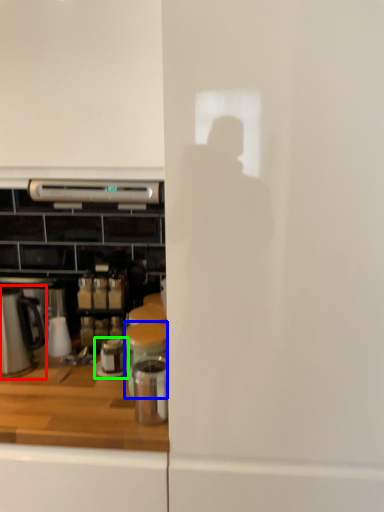
Question: Which is farther away from kitchen appliance (highlighted by a red box)? appliance (highlighted by a blue box) or appliance (highlighted by a green box)?

Choices:
 (A) appliance
 (B) appliance

Answer: (A)